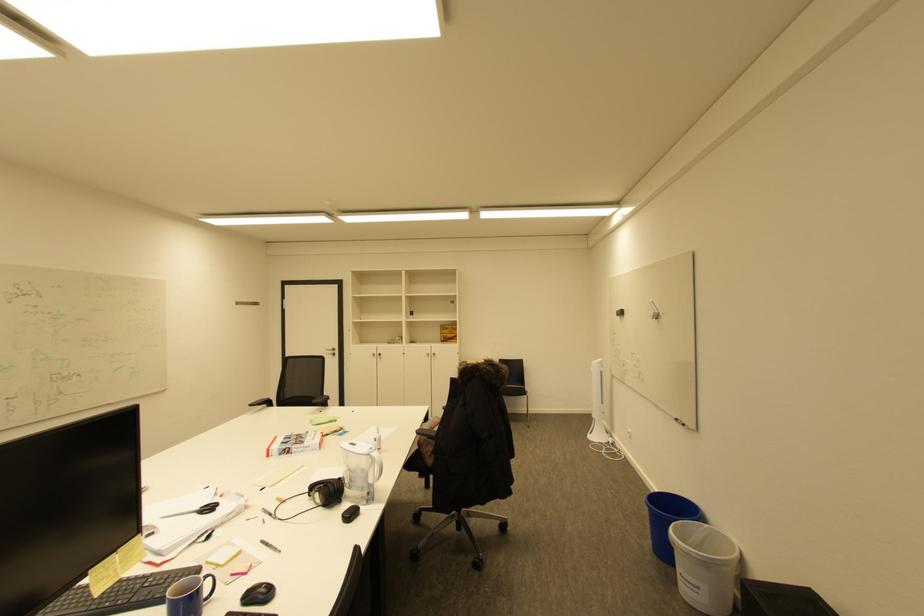
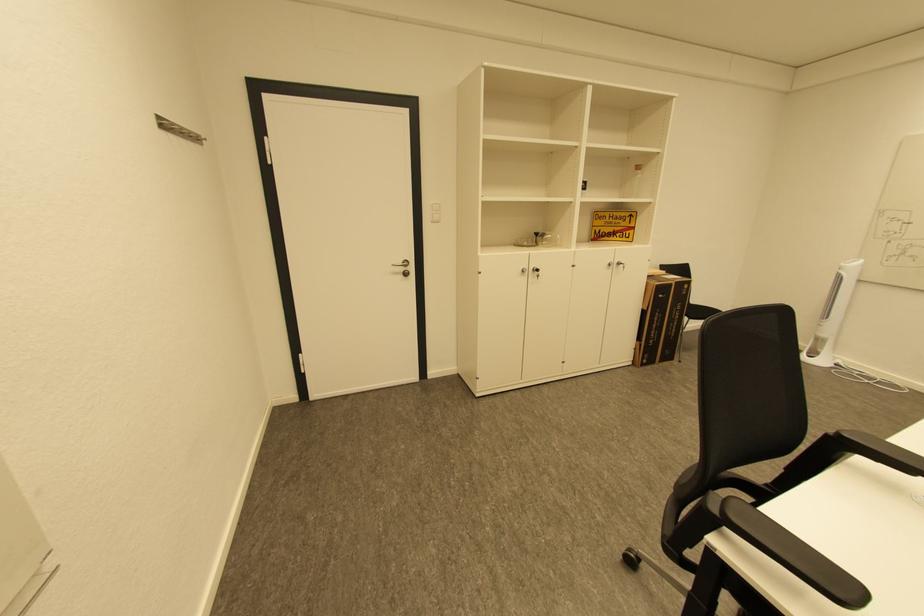
Where in the second image is the point corresponding to the point at 380,355 from the first image?

(529, 272)